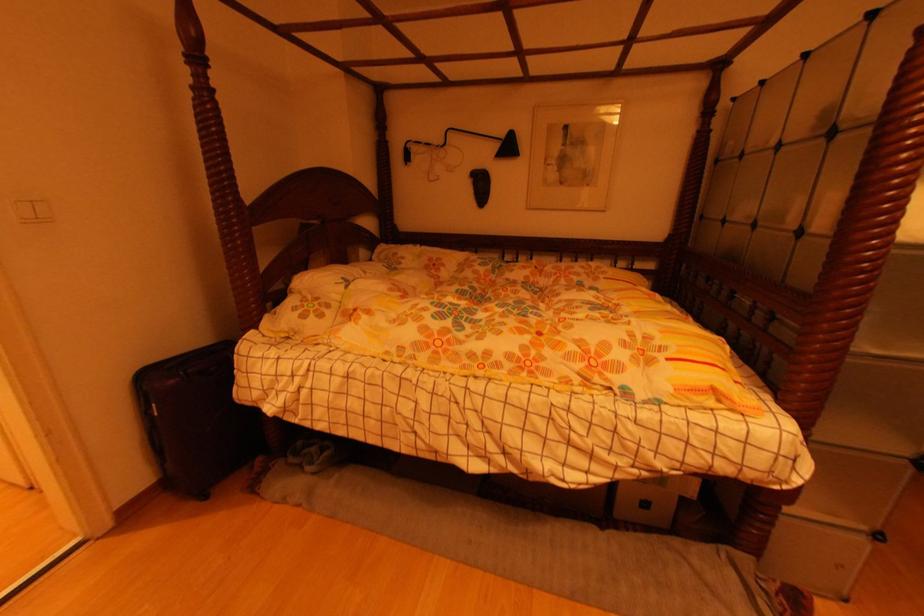
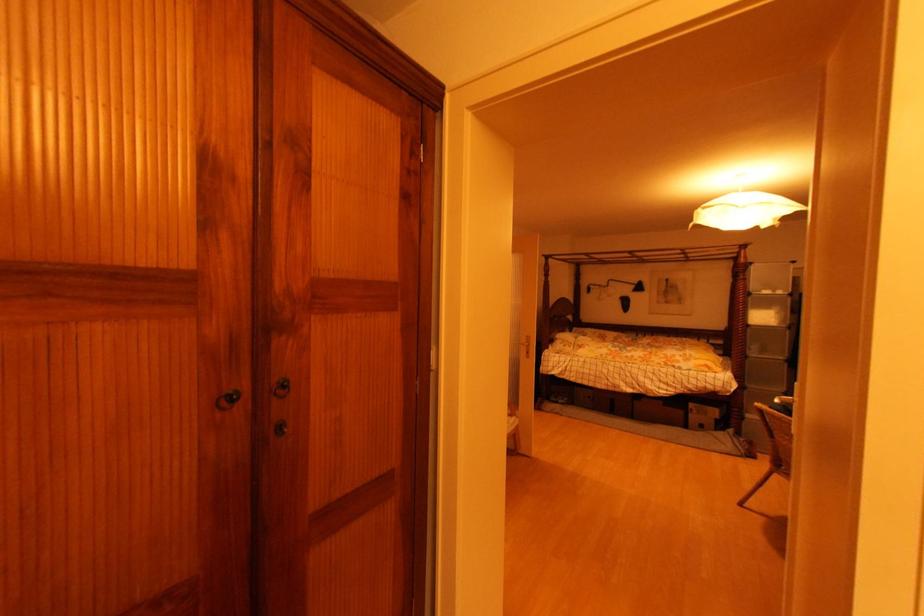
The point at (871,347) is marked in the first image. Where is the corresponding point in the second image?

(759, 355)